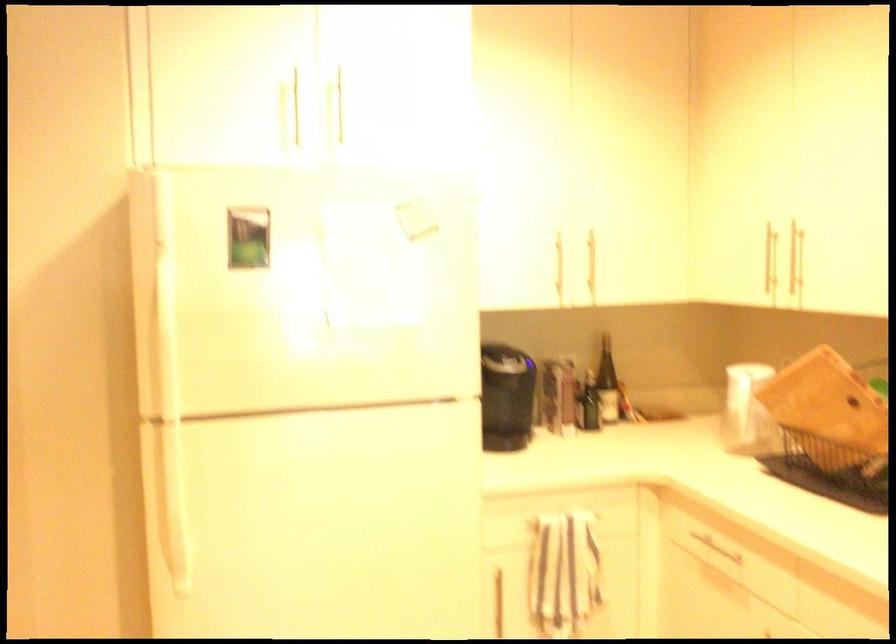
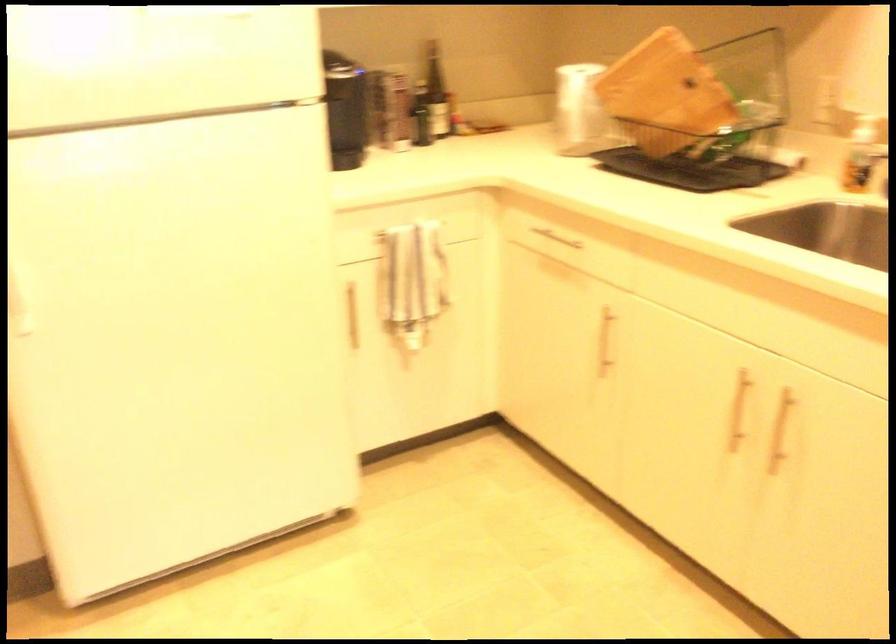
The point at (752, 410) is marked in the first image. Where is the corresponding point in the second image?

(579, 108)